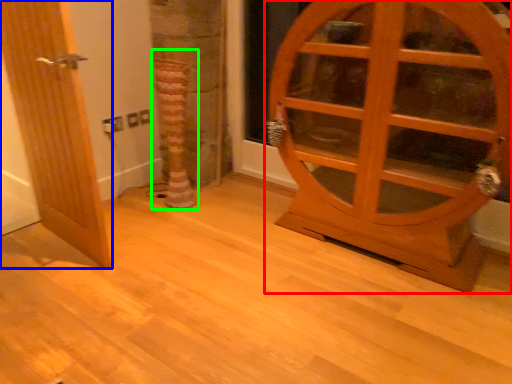
Question: Estimate the real-world distances between objects in this image. Which object is farther from door (highlighted by a red box), door (highlighted by a blue box) or tree trunk (highlighted by a green box)?

Choices:
 (A) door
 (B) tree trunk

Answer: (A)